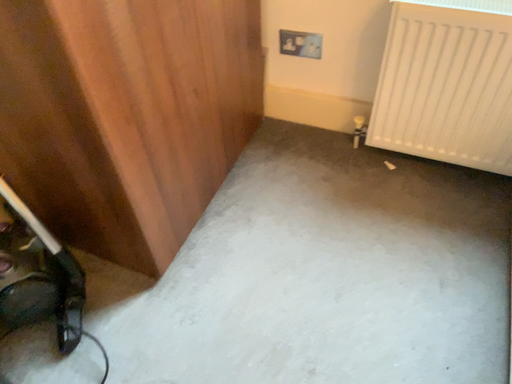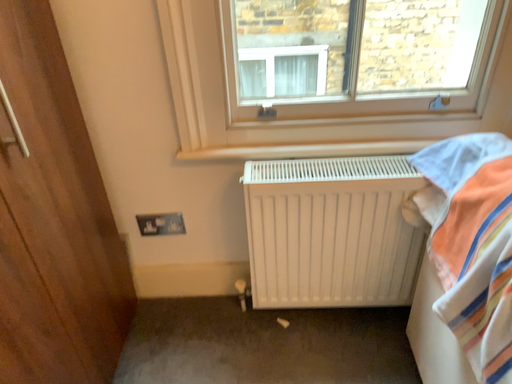
Question: Which way did the camera rotate in the video?

Choices:
 (A) rotated left
 (B) rotated right

Answer: (B)